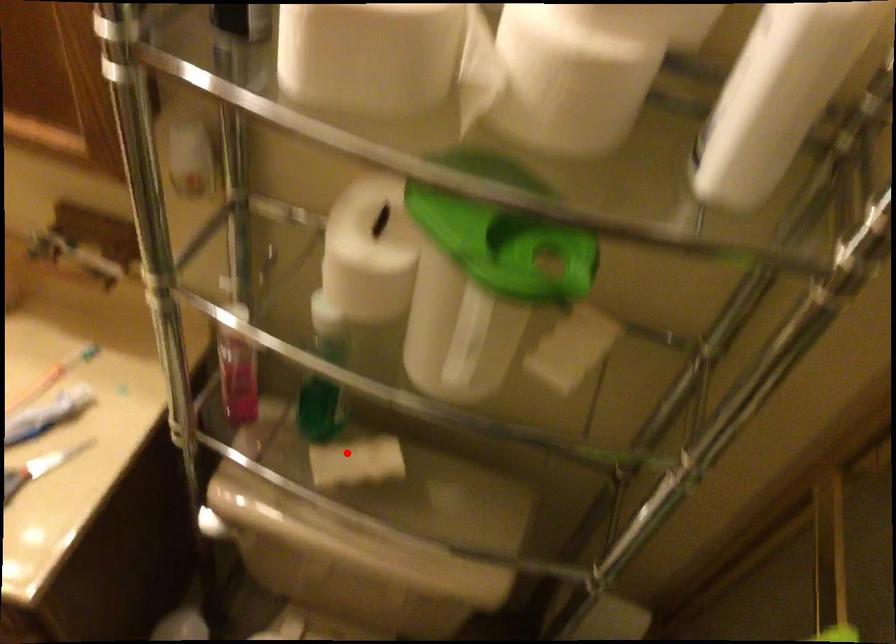
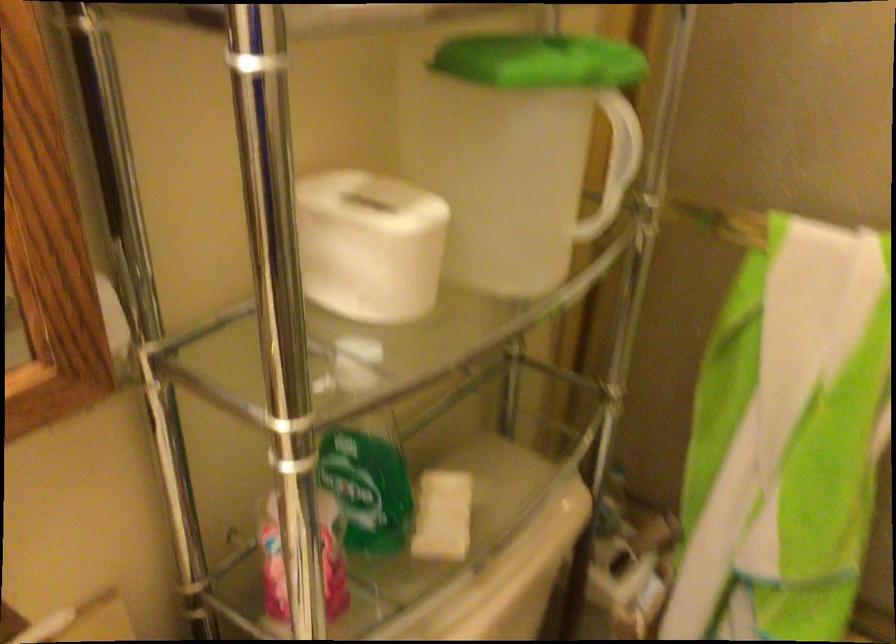
Question: I am providing you with two images of the same scene from different viewpoints. In image1, a red point is highlighted. Considering the same 3D point in image2, which of the following is correct?

Choices:
 (A) It is closer
 (B) It is farther

Answer: (A)